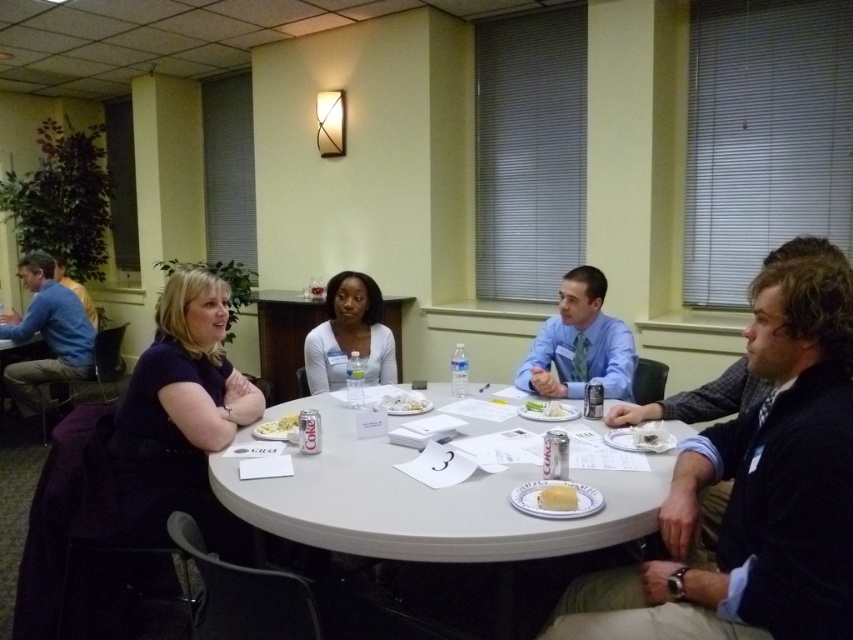
You are a guest at a meeting and want to grab a slice of cake without moving from your seat. You see the yellow cake at lower center and the white matte cake at center. Which cake can you reach without moving your chair?

The yellow cake at lower center is in front of the white matte cake at center, so you can reach the yellow cake at lower center without moving your chair.

You are standing at the entrance of the conference room and see the table with several items. There is a point marked at coordinate (349, 336) on the table. What object is located at that point?

The point at coordinate (349, 336) indicates the location of the smooth white shirt at center.